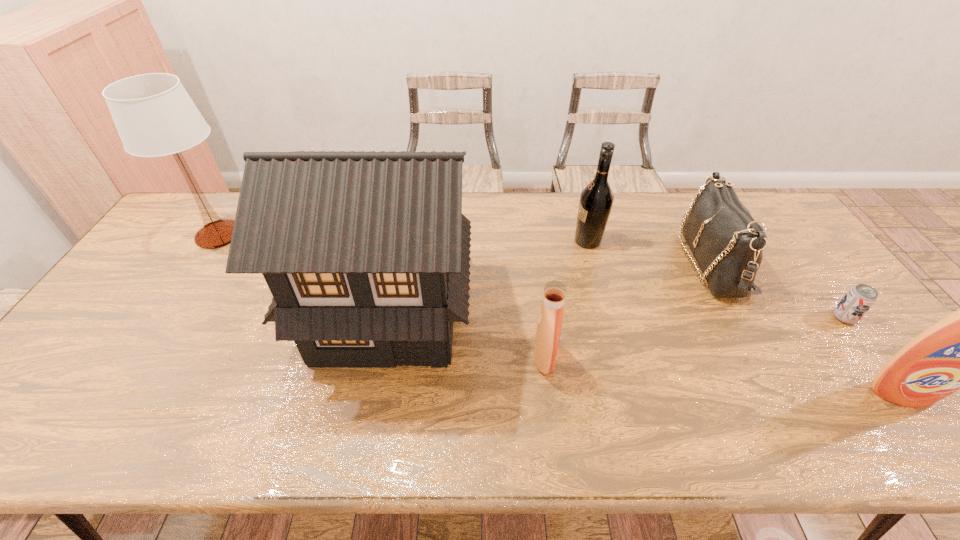
Locate an element on the screen. This screenshot has height=540, width=960. blank space located at the front of the handbag with chain and zipper is located at coordinates (651, 262).

The image size is (960, 540). I want to click on vacant area situated at the front of the handbag with chain and zipper, so click(x=559, y=262).

You are a GUI agent. You are given a task and a screenshot of the screen. Output one action in this format:
    pyautogui.click(x=<x>, y=<y>)
    Task: Click on the vacant space located 0.370m on the label of the fourth object from right to left
    The image size is (960, 540).
    Given the screenshot: What is the action you would take?
    pyautogui.click(x=457, y=241)

The image size is (960, 540). I want to click on vacant space located 0.130m on the label of the fourth object from right to left, so click(x=532, y=241).

The image size is (960, 540). I want to click on vacant space situated 0.310m on the label of the fourth object from right to left, so tap(476, 241).

Locate an element on the screen. blank space located above the cylindrical shade of the leftmost object is located at coordinates click(x=144, y=349).

The width and height of the screenshot is (960, 540). I want to click on free space located on the back of the beer can, so click(x=794, y=251).

The width and height of the screenshot is (960, 540). In order to click on handbag at the far edge in this screenshot , I will do click(727, 243).

Where is `wine bottle that is at the far edge`? The height and width of the screenshot is (540, 960). wine bottle that is at the far edge is located at coordinates (596, 200).

Find the location of a particular element. This screenshot has width=960, height=540. table lamp at the far edge is located at coordinates (154, 115).